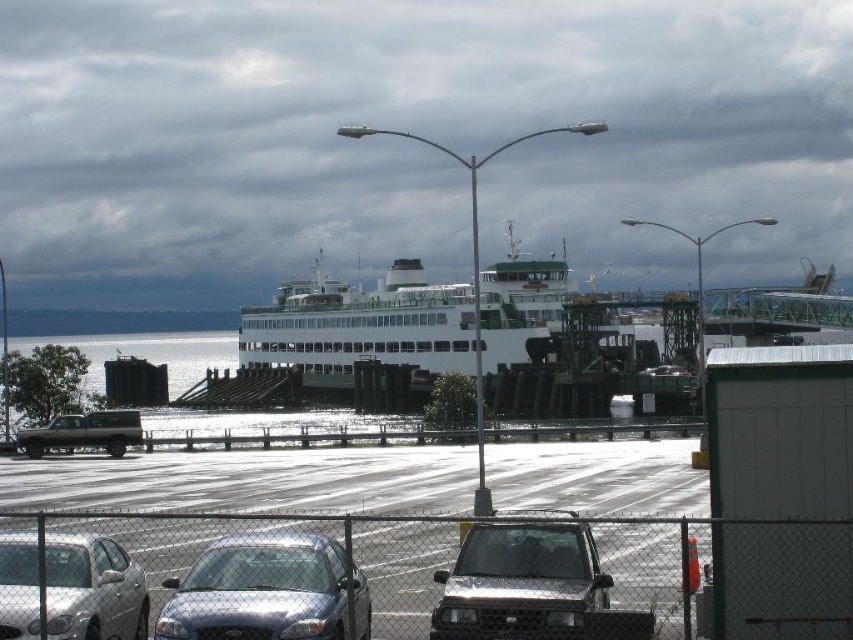
Question: Does shiny silver suv at center appear over silver metallic sedan at lower left?

Choices:
 (A) yes
 (B) no

Answer: (A)

Question: Which object is farther from the camera taking this photo?

Choices:
 (A) shiny silver suv at center
 (B) satin silver sedan at center

Answer: (B)

Question: From the image, what is the correct spatial relationship of white matte ferry at center in relation to silver metallic sedan at lower left?

Choices:
 (A) below
 (B) above

Answer: (B)

Question: Which object is the farthest from the satin silver sedan at center?

Choices:
 (A) silver metallic sedan at lower left
 (B) shiny silver suv at center
 (C) white matte ferry at center

Answer: (C)

Question: Which of the following is the closest to the observer?

Choices:
 (A) (0, 600)
 (B) (531, 531)

Answer: (B)

Question: Does white matte ferry at center come behind satin silver sedan at center?

Choices:
 (A) no
 (B) yes

Answer: (B)